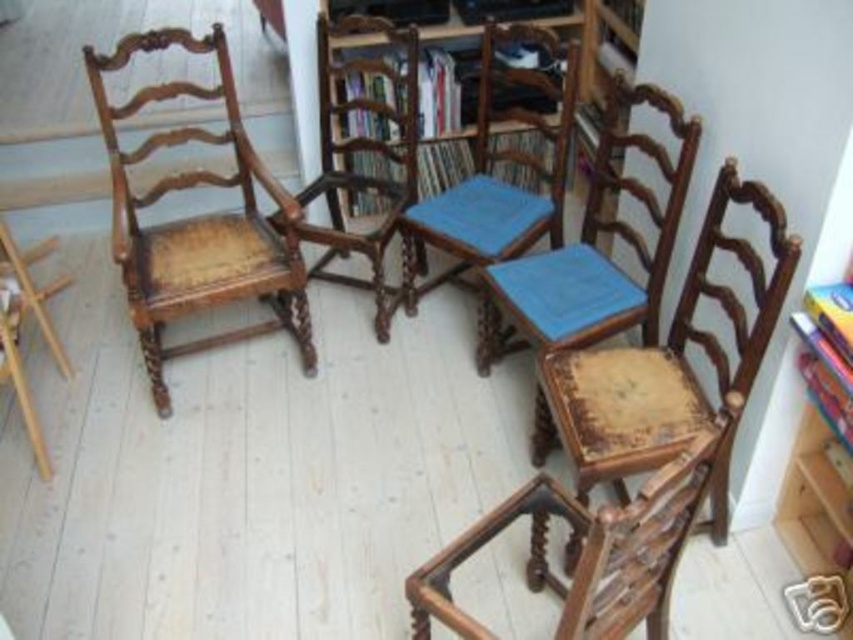
Can you confirm if wooden woven seat at lower right is positioned to the left of rustic wood chair at left?

No, wooden woven seat at lower right is not to the left of rustic wood chair at left.

Can you confirm if wooden woven seat at lower right is positioned above rustic wood chair at left?

No, wooden woven seat at lower right is not above rustic wood chair at left.

Does point (705, 346) lie behind point (119, 241)?

No.

Find the location of a particular element. The height and width of the screenshot is (640, 853). wooden woven seat at lower right is located at coordinates (666, 356).

Is rustic wood chair at left shorter than wooden textured rocking chair at lower right?

In fact, rustic wood chair at left may be taller than wooden textured rocking chair at lower right.

Who is more forward, (141, 316) or (689, 529)?

Point (689, 529)

Where is `rustic wood chair at left`? The width and height of the screenshot is (853, 640). rustic wood chair at left is located at coordinates (196, 220).

Can you confirm if wooden chair with blue cushion at center is shorter than wooden armchair at center?

Indeed, wooden chair with blue cushion at center has a lesser height compared to wooden armchair at center.

Does wooden chair with blue cushion at center have a lesser width compared to wooden armchair at center?

No.

Is point (526, 308) in front of point (361, 22)?

Yes, it is in front of point (361, 22).

Locate an element on the screen. This screenshot has height=640, width=853. wooden chair with blue cushion at center is located at coordinates (595, 248).